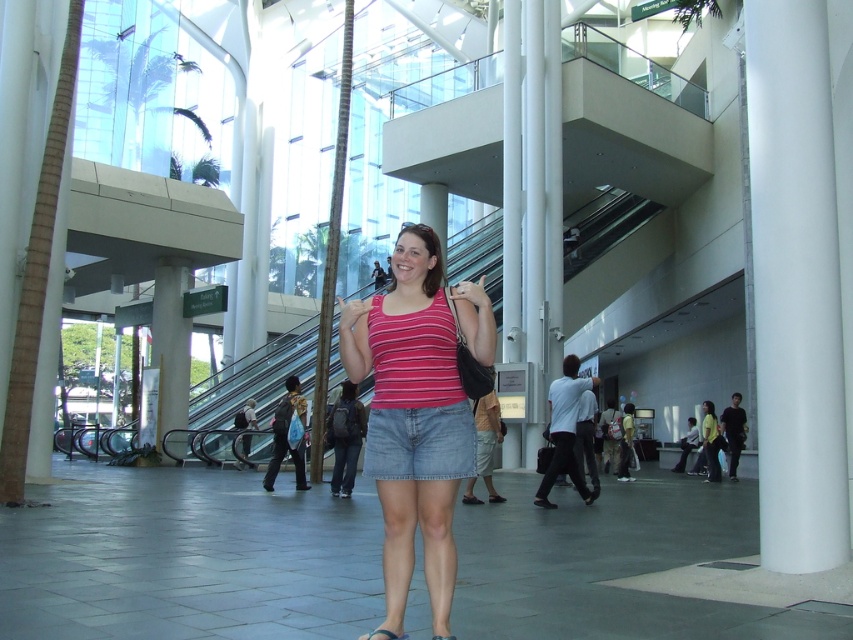
You are standing in the shopping mall and want to take a photo of the point at coordinates [558,452]. If your camera has a maximum zoom range of 30 feet, will you be able to capture the point clearly?

The point at coordinates [558,452] is 36.00 feet away from the viewer. Since the camera can only zoom up to 30 feet, it will not be able to capture the point clearly at this distance.

You are a photographer trying to capture both the striped cotton tank top at center and the white cotton shirt at center in a single frame. Which clothing item will appear smaller in the photo?

The striped cotton tank top at center will appear smaller in the photo because it is smaller than the white cotton shirt at center.